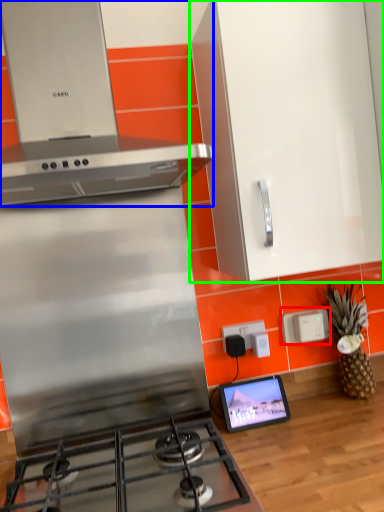
Question: Which object is the farthest from electric outlet (highlighted by a red box)? Choose among these: home appliance (highlighted by a blue box) or cabinetry (highlighted by a green box).

Choices:
 (A) home appliance
 (B) cabinetry

Answer: (A)